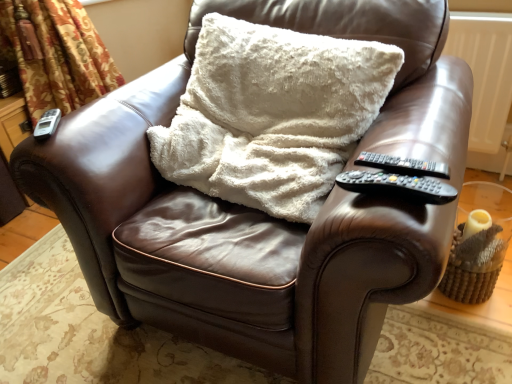
Question: Can you confirm if floral fabric curtain at left is shorter than black plastic remote at right, the second remote when ordered from bottom to top?

Choices:
 (A) yes
 (B) no

Answer: (B)

Question: Can you confirm if floral fabric curtain at left is taller than black plastic remote at right, the 3th remote viewed from the left?

Choices:
 (A) yes
 (B) no

Answer: (A)

Question: Is black plastic remote at right, which is the second remote in front-to-back order, at the back of floral fabric curtain at left?

Choices:
 (A) yes
 (B) no

Answer: (B)

Question: Can black plastic remote at right, positioned as the first remote in right-to-left order, be found inside floral fabric curtain at left?

Choices:
 (A) yes
 (B) no

Answer: (B)

Question: Is floral fabric curtain at left at the right side of black plastic remote at right, the 3th remote viewed from the left?

Choices:
 (A) yes
 (B) no

Answer: (B)

Question: Does floral fabric curtain at left come behind black plastic remote at right, the second remote when ordered from bottom to top?

Choices:
 (A) no
 (B) yes

Answer: (B)

Question: Could black plastic remote at right armrest, which is the third remote from back to front, be considered to be inside white fluffy pillow at center?

Choices:
 (A) no
 (B) yes

Answer: (A)

Question: Does white fluffy pillow at center appear on the right side of black plastic remote at right armrest, the 1th remote positioned from the bottom?

Choices:
 (A) no
 (B) yes

Answer: (A)

Question: From the image's perspective, is white fluffy pillow at center under black plastic remote at right armrest, placed as the third remote when sorted from top to bottom?

Choices:
 (A) yes
 (B) no

Answer: (B)

Question: Is white fluffy pillow at center shorter than black plastic remote at right armrest, which is the third remote from back to front?

Choices:
 (A) no
 (B) yes

Answer: (A)

Question: Would you say white fluffy pillow at center is a long distance from black plastic remote at right armrest, placed as the third remote when sorted from top to bottom?

Choices:
 (A) no
 (B) yes

Answer: (A)

Question: Is white fluffy pillow at center smaller than black plastic remote at right armrest, which is the third remote from back to front?

Choices:
 (A) yes
 (B) no

Answer: (B)

Question: Can you confirm if black plastic remote at right, the 3th remote viewed from the left, is positioned to the left of floral fabric curtain at left?

Choices:
 (A) no
 (B) yes

Answer: (A)